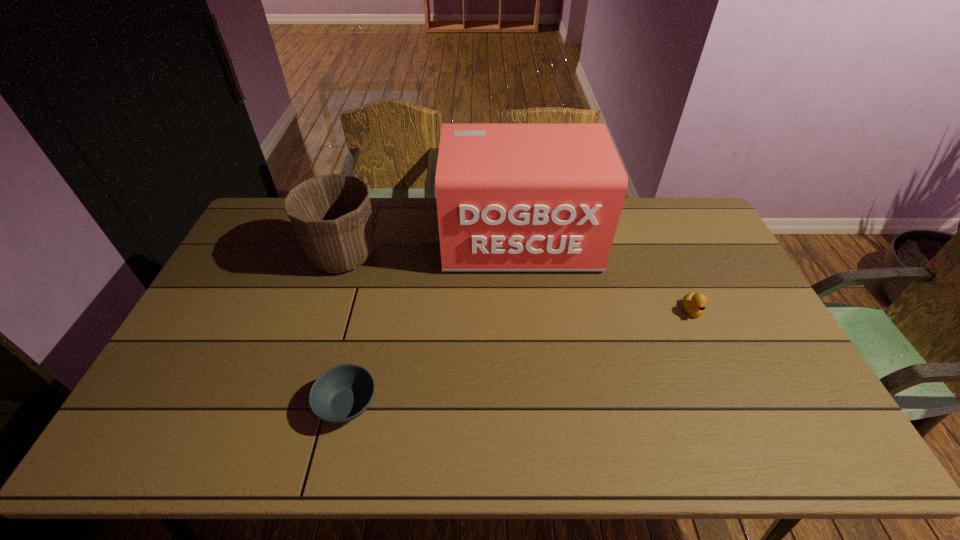
Locate an element on the screen. The width and height of the screenshot is (960, 540). box is located at coordinates (510, 196).

This screenshot has height=540, width=960. What are the coordinates of `the second object from right to left` in the screenshot? It's located at (510, 196).

Locate an element on the screen. flowerpot is located at coordinates (331, 214).

Where is `the third farthest object`? Image resolution: width=960 pixels, height=540 pixels. the third farthest object is located at coordinates (694, 304).

The height and width of the screenshot is (540, 960). What are the coordinates of `the second shortest object` in the screenshot? It's located at (694, 304).

Identify the location of the nearest object. The image size is (960, 540). (341, 394).

Where is `the shortest object`? This screenshot has width=960, height=540. the shortest object is located at coordinates (341, 394).

Find the location of a particular element. vacant space located 0.340m on the surface of the second object from right to left where the text is embossed is located at coordinates (533, 366).

Find the location of a particular element. This screenshot has width=960, height=540. vacant space situated on the front of the flowerpot is located at coordinates [301, 387].

At what (x,y) coordinates should I click in order to perform the action: click on vacant region located on the face of the second nearest object. Please return your answer as a coordinate pair (x, y). The width and height of the screenshot is (960, 540). Looking at the image, I should click on (706, 341).